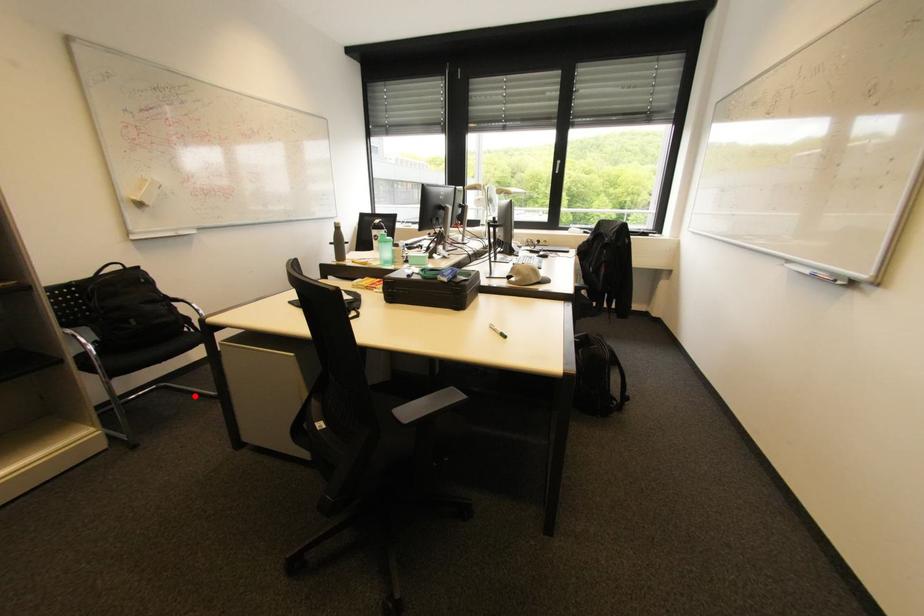
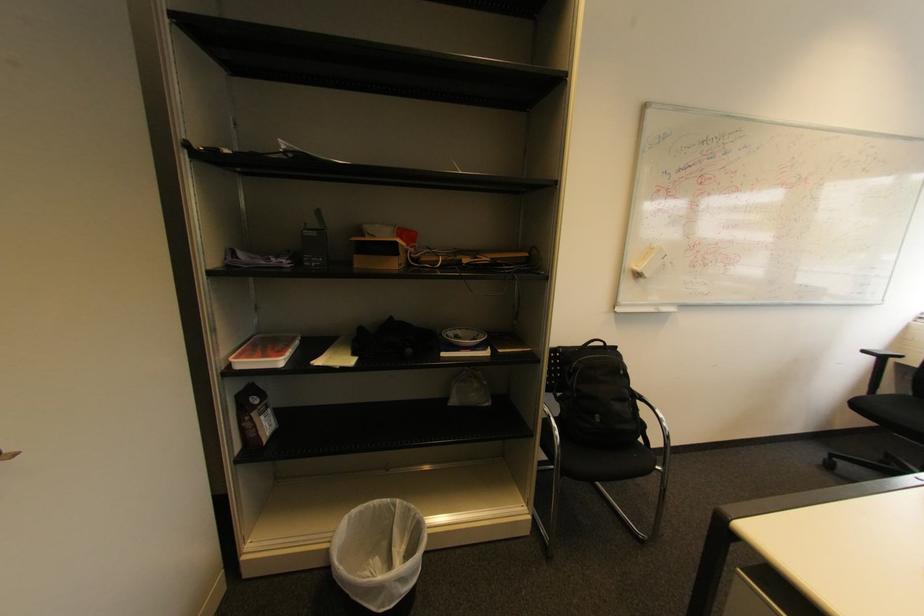
Question: I am providing you with two images of the same scene from different viewpoints. In image1, a red point is highlighted. Considering the same 3D point in image2, which of the following is correct?

Choices:
 (A) It is closer
 (B) It is farther

Answer: (B)